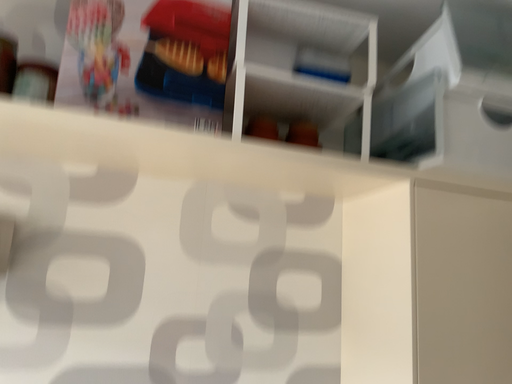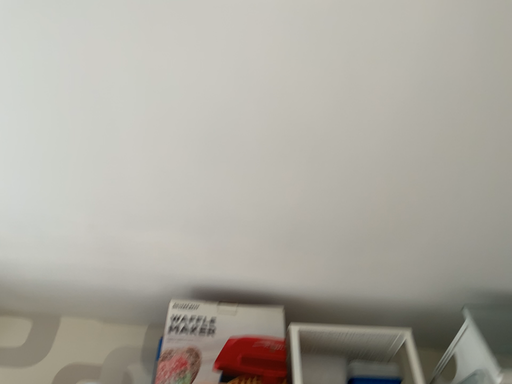
Question: Which way did the camera rotate in the video?

Choices:
 (A) rotated upward
 (B) rotated downward

Answer: (A)